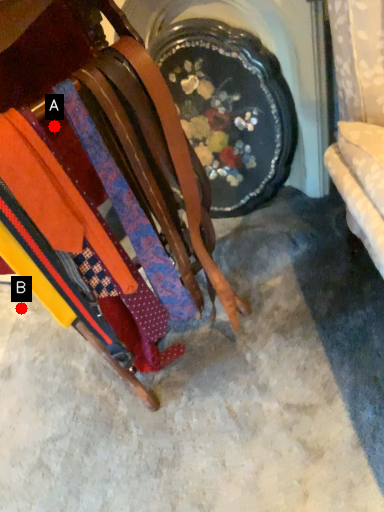
Question: Two points are circled on the image, labeled by A and B beside each circle. Which of the following is the closest to the observer?

Choices:
 (A) A is closer
 (B) B is closer

Answer: (A)